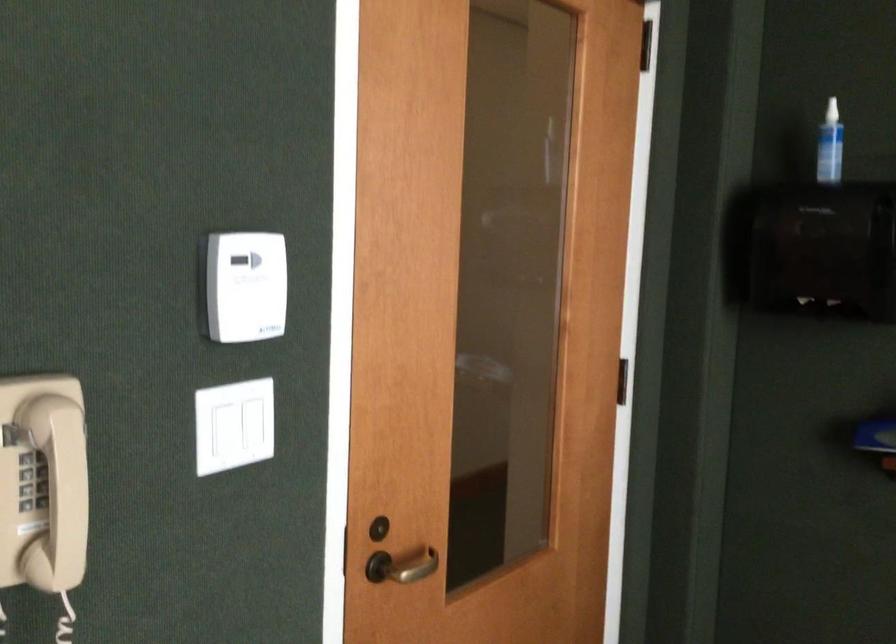
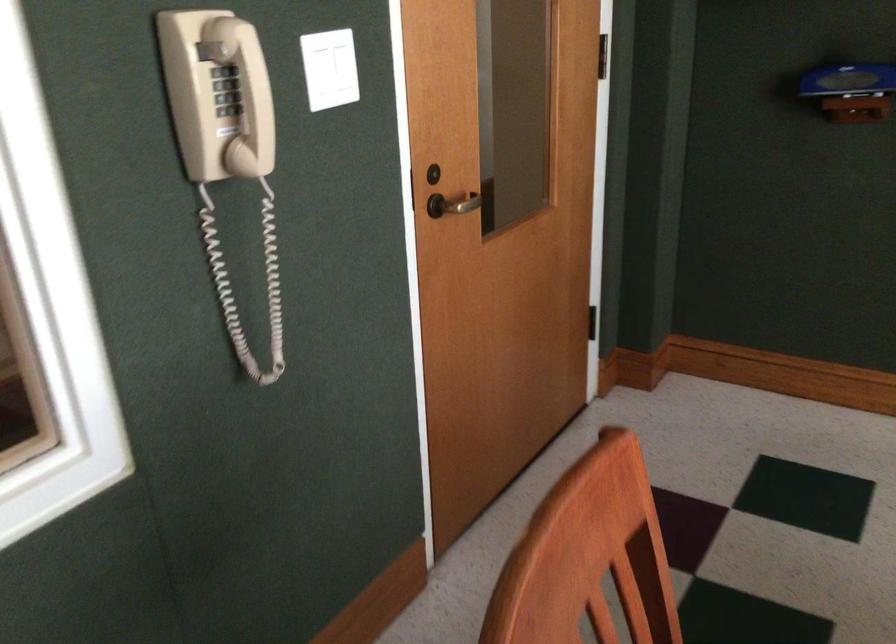
The point at (343, 558) is marked in the first image. Where is the corresponding point in the second image?

(409, 191)